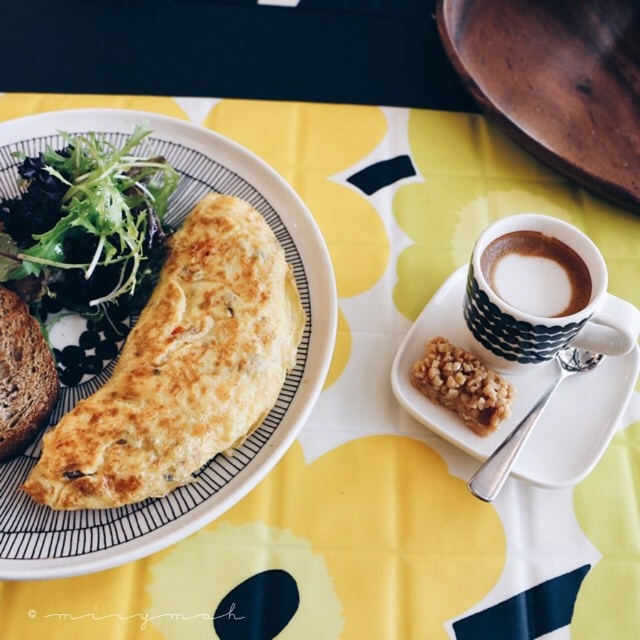
Question: Which point is closer to the camera?

Choices:
 (A) (467, 394)
 (B) (42, 401)
 (C) (157, 180)
 (D) (24, 140)

Answer: (B)

Question: Among these objects, which one is farthest from the camera?

Choices:
 (A) dark brown ceramic cup at upper right
 (B) wooden spoon at upper right
 (C) white ceramic plate at upper right

Answer: (B)

Question: Does cappuccino foam cup at right appear on the right side of brown rustic bread at left?

Choices:
 (A) yes
 (B) no

Answer: (A)

Question: Which of the following is the farthest from the observer?

Choices:
 (A) dark brown ceramic cup at upper right
 (B) cappuccino foam cup at right
 (C) brown rustic bread at left

Answer: (B)

Question: Is cappuccino foam cup at right thinner than crumbly brown bar at center?

Choices:
 (A) no
 (B) yes

Answer: (B)

Question: Can you confirm if wooden spoon at upper right is thinner than crumbly brown bar at center?

Choices:
 (A) no
 (B) yes

Answer: (A)